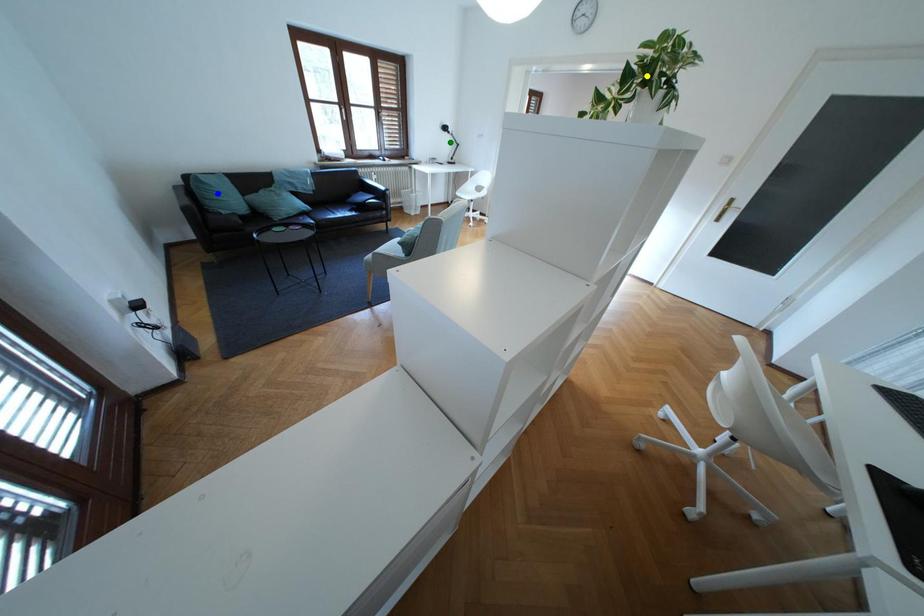
Order these from nearest to farthest:
A) yellow point
B) blue point
C) green point

yellow point, blue point, green point